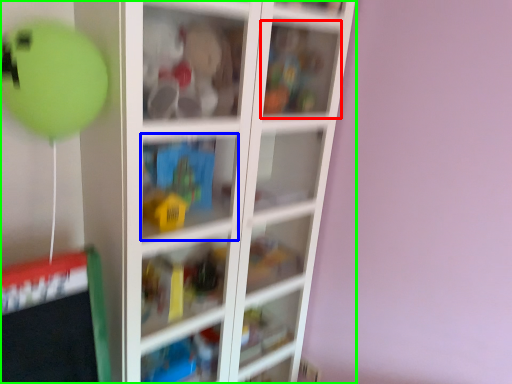
Question: Considering the real-world distances, which object is farthest from cabinet (highlighted by a red box)? cabinet (highlighted by a blue box) or shelf (highlighted by a green box)?

Choices:
 (A) cabinet
 (B) shelf

Answer: (A)